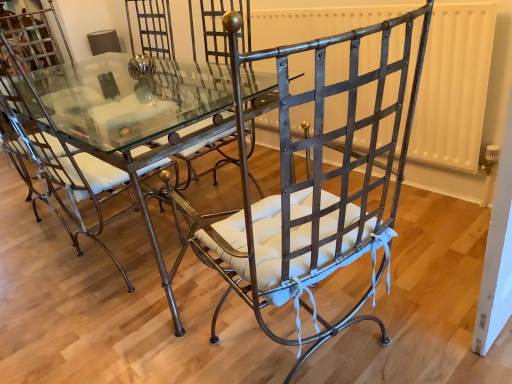
Question: From the image's perspective, does wrought iron chair at center, which ranks as the 2th chair in right-to-left order, appear higher than metallic wrought iron chair at center, positioned as the first chair in right-to-left order?

Choices:
 (A) no
 (B) yes

Answer: (B)

Question: Is wrought iron chair at center, which is the 1th chair from left to right, not within metallic wrought iron chair at center, positioned as the first chair in right-to-left order?

Choices:
 (A) yes
 (B) no

Answer: (A)

Question: Is there a large distance between wrought iron chair at center, which is the 1th chair from left to right, and metallic wrought iron chair at center, positioned as the first chair in right-to-left order?

Choices:
 (A) yes
 (B) no

Answer: (B)

Question: Does wrought iron chair at center, which ranks as the 2th chair in right-to-left order, contain metallic wrought iron chair at center, positioned as the first chair in right-to-left order?

Choices:
 (A) no
 (B) yes

Answer: (A)

Question: Does wrought iron chair at center, which is the 1th chair from left to right, have a lesser height compared to metallic wrought iron chair at center, which is the second chair in left-to-right order?

Choices:
 (A) yes
 (B) no

Answer: (A)

Question: From the image's perspective, is metallic wrought iron chair at center, positioned as the first chair in right-to-left order, positioned above or below clear glass table at center?

Choices:
 (A) above
 (B) below

Answer: (B)

Question: Is metallic wrought iron chair at center, which is the second chair in left-to-right order, situated inside clear glass table at center or outside?

Choices:
 (A) inside
 (B) outside

Answer: (B)

Question: Considering the positions of metallic wrought iron chair at center, positioned as the first chair in right-to-left order, and clear glass table at center in the image, is metallic wrought iron chair at center, positioned as the first chair in right-to-left order, taller or shorter than clear glass table at center?

Choices:
 (A) tall
 (B) short

Answer: (A)

Question: From a real-world perspective, is metallic wrought iron chair at center, positioned as the first chair in right-to-left order, above or below clear glass table at center?

Choices:
 (A) above
 (B) below

Answer: (A)

Question: Is clear glass table at center bigger or smaller than metallic wrought iron chair at center, positioned as the first chair in right-to-left order?

Choices:
 (A) small
 (B) big

Answer: (B)

Question: From a real-world perspective, is clear glass table at center above or below metallic wrought iron chair at center, positioned as the first chair in right-to-left order?

Choices:
 (A) below
 (B) above

Answer: (A)

Question: Which is correct: clear glass table at center is inside metallic wrought iron chair at center, which is the second chair in left-to-right order, or outside of it?

Choices:
 (A) outside
 (B) inside

Answer: (A)

Question: Is point (19, 102) positioned closer to the camera than point (207, 248)?

Choices:
 (A) farther
 (B) closer

Answer: (A)

Question: Do you think clear glass table at center is within wrought iron chair at center, which ranks as the 2th chair in right-to-left order, or outside of it?

Choices:
 (A) outside
 (B) inside

Answer: (A)

Question: From the image's perspective, relative to wrought iron chair at center, which ranks as the 2th chair in right-to-left order, is clear glass table at center above or below?

Choices:
 (A) below
 (B) above

Answer: (B)